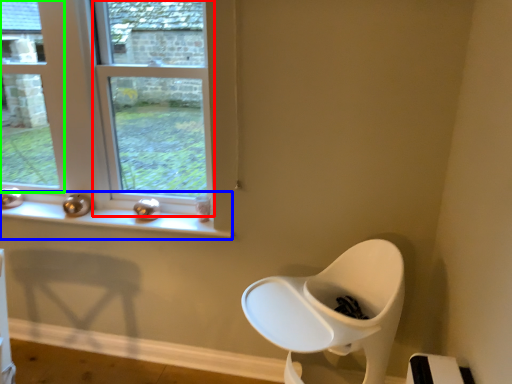
Question: Considering the real-world distances, which object is farthest from window (highlighted by a red box)? window sill (highlighted by a blue box) or window (highlighted by a green box)?

Choices:
 (A) window sill
 (B) window

Answer: (B)